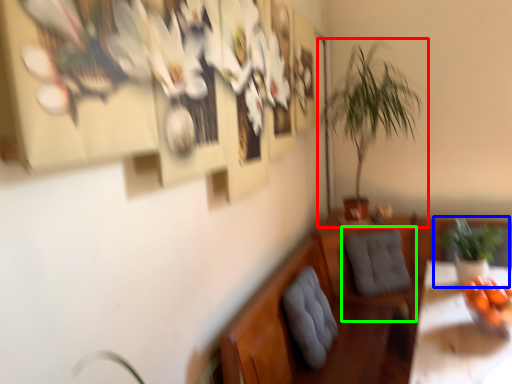
Question: Which object is the closest to the houseplant (highlighted by a red box)? Choose among these: houseplant (highlighted by a blue box) or swivel chair (highlighted by a green box).

Choices:
 (A) houseplant
 (B) swivel chair

Answer: (B)